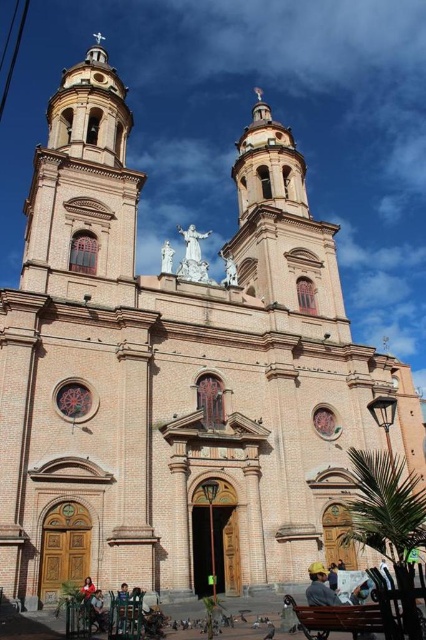
You are a visitor to the church and need to sit down. You see a brown wooden bench at lower center and a white marble statue at center. Which one is a better option for sitting?

The brown wooden bench at lower center is smaller than the white marble statue at center, but the bench is meant for sitting while the statue is an ornamental structure and not designed for seating. Therefore, the brown wooden bench at lower center is the better option for sitting.